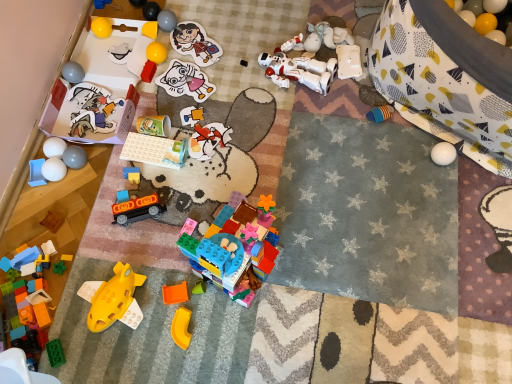
At what (x,y) coordinates should I click in order to perform the action: click on free space in front of matte gray ball at upper center, arranged as the eighth toy when viewed from the right. Please return your answer as a coordinate pair (x, y). Looking at the image, I should click on point(173,66).